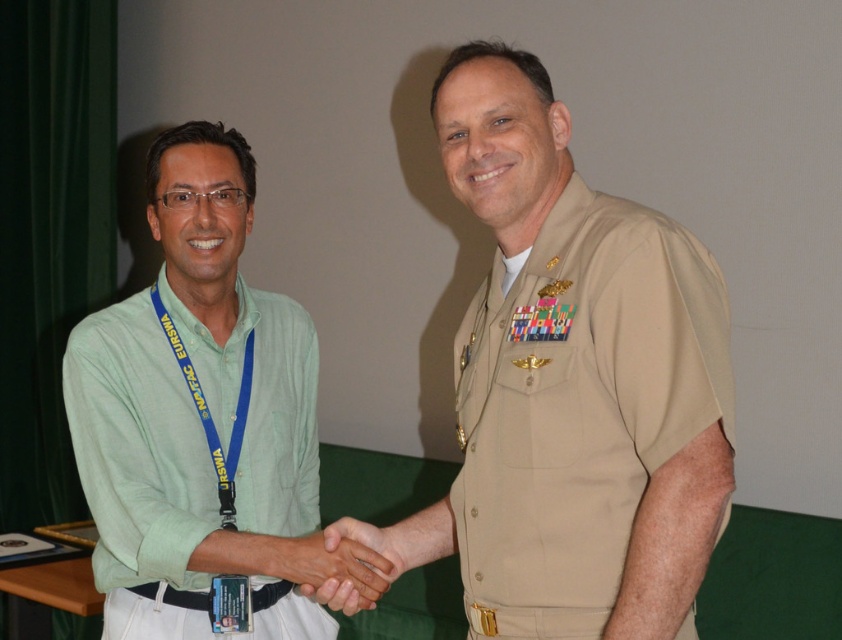
Measure the distance from tan uniform at center to smooth skin handshake at center.

tan uniform at center is 12.91 inches away from smooth skin handshake at center.

Does tan uniform at center have a greater height compared to smooth skin handshake at center?

Yes.

Between point (565, 422) and point (347, 605), which one is positioned behind?

Point (347, 605)

Locate an element on the screen. Image resolution: width=842 pixels, height=640 pixels. tan uniform at center is located at coordinates (578, 408).

Is green cotton shirt at left to the right of tan uniform at center from the viewer's perspective?

Incorrect, green cotton shirt at left is not on the right side of tan uniform at center.

The height and width of the screenshot is (640, 842). Describe the element at coordinates (203, 420) in the screenshot. I see `green cotton shirt at left` at that location.

You are a GUI agent. You are given a task and a screenshot of the screen. Output one action in this format:
    pyautogui.click(x=<x>, y=<y>)
    Task: Click on the green cotton shirt at left
    This screenshot has height=640, width=842.
    Given the screenshot: What is the action you would take?
    pyautogui.click(x=203, y=420)

Is tan uniform at center bigger than blue fabric lanyard at left?

Yes.

Which is below, tan uniform at center or blue fabric lanyard at left?

Positioned lower is tan uniform at center.

Is point (605, 500) in front of point (190, 369)?

That is True.

The height and width of the screenshot is (640, 842). Find the location of `tan uniform at center`. tan uniform at center is located at coordinates (578, 408).